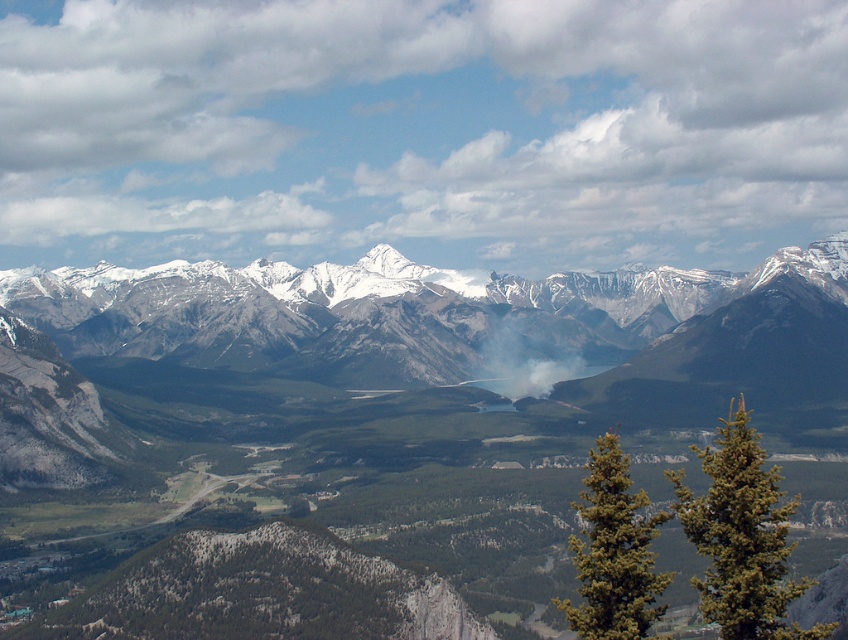
Question: Where is green textured pine tree at right located in relation to white smoke at center in the image?

Choices:
 (A) right
 (B) left

Answer: (B)

Question: Is green textured pine tree at right to the right of white smoke at center from the viewer's perspective?

Choices:
 (A) no
 (B) yes

Answer: (A)

Question: Estimate the real-world distances between objects in this image. Which object is farther from the green textured pine tree at right?

Choices:
 (A) white smoke at center
 (B) snowy granite mountains at center
 (C) green needle-like tree at lower right

Answer: (B)

Question: Which point is farther from the camera taking this photo?

Choices:
 (A) [x=166, y=276]
 (B) [x=704, y=586]

Answer: (A)

Question: Where is green needle-like tree at lower right located in relation to green textured pine tree at right in the image?

Choices:
 (A) above
 (B) below

Answer: (B)

Question: Which point appears farthest from the camera in this image?

Choices:
 (A) (790, 545)
 (B) (721, 298)

Answer: (B)